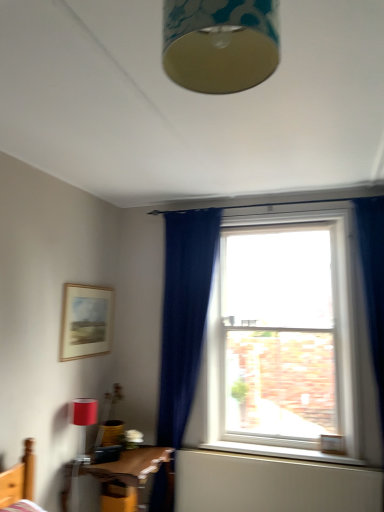
Question: Based on their positions, is matte wooden picture frame at upper left located to the left or right of matte gold lampshade at upper center?

Choices:
 (A) left
 (B) right

Answer: (A)

Question: Choose the correct answer: Is matte wooden picture frame at upper left inside matte gold lampshade at upper center or outside it?

Choices:
 (A) inside
 (B) outside

Answer: (B)

Question: Estimate the real-world distances between objects in this image. Which object is farther from the wooden table at lower left?

Choices:
 (A) matte wooden picture frame at upper left
 (B) white plastic window at center
 (C) matte gold lampshade at upper center
 (D) matte red lampshade at lower left
 (E) white wooden window sill at lower center

Answer: (C)

Question: Estimate the real-world distances between objects in this image. Which object is farther from the matte red lampshade at lower left?

Choices:
 (A) matte wooden picture frame at upper left
 (B) wooden table at lower left
 (C) matte gold lampshade at upper center
 (D) white plastic window at center
 (E) white wooden window sill at lower center

Answer: (C)